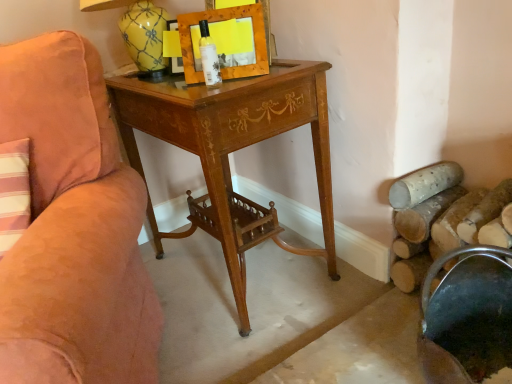
Question: Is wooden picture frame at upper center inside the boundaries of wooden desk at center, or outside?

Choices:
 (A) outside
 (B) inside

Answer: (A)

Question: Is wooden picture frame at upper center bigger or smaller than wooden desk at center?

Choices:
 (A) big
 (B) small

Answer: (B)

Question: Which of these objects is positioned closest to the wooden picture frame at upper center?

Choices:
 (A) clear glass bottle at center
 (B) metallic dark green bucket at lower right
 (C) wooden desk at center
 (D) suede-like peach chair at left

Answer: (A)

Question: Considering the real-world distances, which object is farthest from the wooden picture frame at upper center?

Choices:
 (A) wooden desk at center
 (B) suede-like peach chair at left
 (C) clear glass bottle at center
 (D) metallic dark green bucket at lower right

Answer: (D)